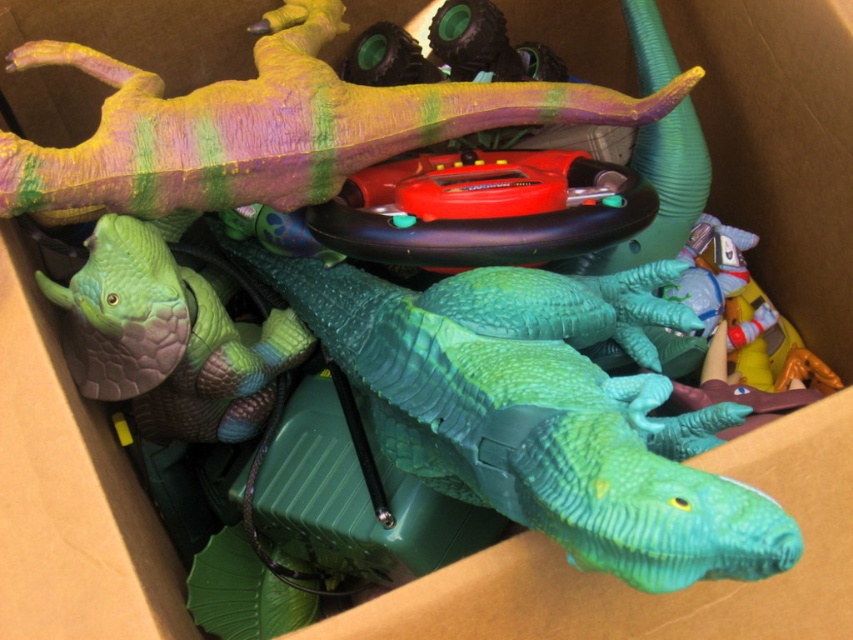
Question: Does green plastic dinosaur at center lie in front of multicolored rubber dinosaur at upper center?

Choices:
 (A) yes
 (B) no

Answer: (A)

Question: Is green plastic dinosaur at center further to camera compared to multicolored rubber dinosaur at upper center?

Choices:
 (A) no
 (B) yes

Answer: (A)

Question: Which point is closer to the camera?

Choices:
 (A) green plastic dinosaur at center
 (B) multicolored rubber dinosaur at upper center

Answer: (A)

Question: Is green plastic dinosaur at center positioned in front of multicolored rubber dinosaur at upper center?

Choices:
 (A) no
 (B) yes

Answer: (B)